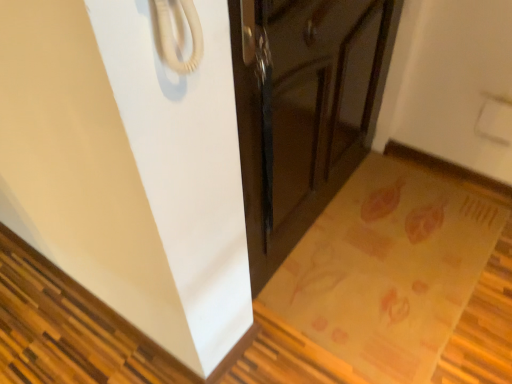
Question: Does glossy dark wood cabinet at center have a smaller size compared to yellowish-brown textured mat at lower right?

Choices:
 (A) yes
 (B) no

Answer: (B)

Question: Does glossy dark wood cabinet at center appear on the left side of yellowish-brown textured mat at lower right?

Choices:
 (A) no
 (B) yes

Answer: (B)

Question: From the image's perspective, is glossy dark wood cabinet at center over yellowish-brown textured mat at lower right?

Choices:
 (A) no
 (B) yes

Answer: (B)

Question: Is the position of glossy dark wood cabinet at center more distant than that of yellowish-brown textured mat at lower right?

Choices:
 (A) no
 (B) yes

Answer: (A)

Question: Is glossy dark wood cabinet at center to the right of yellowish-brown textured mat at lower right from the viewer's perspective?

Choices:
 (A) yes
 (B) no

Answer: (B)

Question: Does glossy dark wood cabinet at center turn towards yellowish-brown textured mat at lower right?

Choices:
 (A) yes
 (B) no

Answer: (A)

Question: From the image's perspective, is yellowish-brown textured mat at lower right on glossy dark wood cabinet at center?

Choices:
 (A) no
 (B) yes

Answer: (A)

Question: Considering the relative sizes of yellowish-brown textured mat at lower right and glossy dark wood cabinet at center in the image provided, is yellowish-brown textured mat at lower right thinner than glossy dark wood cabinet at center?

Choices:
 (A) no
 (B) yes

Answer: (A)

Question: Considering the relative sizes of yellowish-brown textured mat at lower right and glossy dark wood cabinet at center in the image provided, is yellowish-brown textured mat at lower right wider than glossy dark wood cabinet at center?

Choices:
 (A) yes
 (B) no

Answer: (A)

Question: Is the depth of yellowish-brown textured mat at lower right greater than that of glossy dark wood cabinet at center?

Choices:
 (A) no
 (B) yes

Answer: (B)

Question: Is glossy dark wood cabinet at center completely or partially inside yellowish-brown textured mat at lower right?

Choices:
 (A) no
 (B) yes

Answer: (A)

Question: Does yellowish-brown textured mat at lower right have a larger size compared to glossy dark wood cabinet at center?

Choices:
 (A) no
 (B) yes

Answer: (A)

Question: Looking at their shapes, would you say yellowish-brown textured mat at lower right is wider or thinner than glossy dark wood cabinet at center?

Choices:
 (A) thin
 (B) wide

Answer: (B)